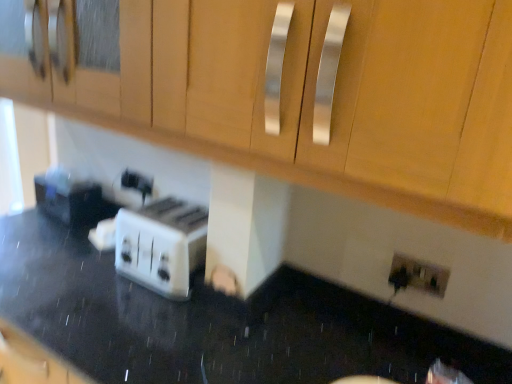
The image size is (512, 384). Find the location of `vacant area situated below matte wood cabinet at upper center (from a real-world perspective)`. vacant area situated below matte wood cabinet at upper center (from a real-world perspective) is located at coordinates (218, 312).